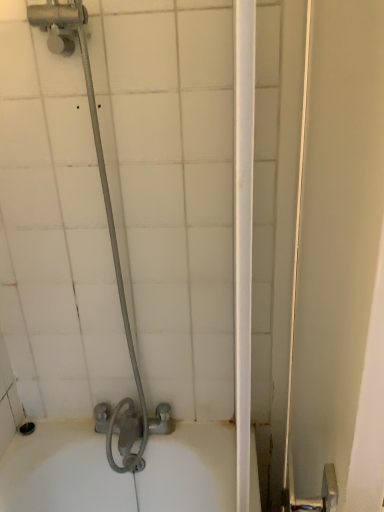
Question: Considering the positions of metallic gray showerhead at left and white glossy screen door at right in the image, is metallic gray showerhead at left bigger or smaller than white glossy screen door at right?

Choices:
 (A) big
 (B) small

Answer: (B)

Question: Looking at their shapes, would you say metallic gray showerhead at left is wider or thinner than white glossy screen door at right?

Choices:
 (A) thin
 (B) wide

Answer: (B)

Question: Is metallic gray showerhead at left taller or shorter than white glossy screen door at right?

Choices:
 (A) short
 (B) tall

Answer: (A)

Question: Visually, is white glossy screen door at right positioned to the left or to the right of metallic gray showerhead at left?

Choices:
 (A) right
 (B) left

Answer: (A)

Question: In terms of width, does white glossy screen door at right look wider or thinner when compared to metallic gray showerhead at left?

Choices:
 (A) wide
 (B) thin

Answer: (B)

Question: Does point (331, 6) appear closer or farther from the camera than point (142, 448)?

Choices:
 (A) farther
 (B) closer

Answer: (B)

Question: Would you say white glossy screen door at right is inside or outside metallic gray showerhead at left?

Choices:
 (A) inside
 (B) outside

Answer: (B)